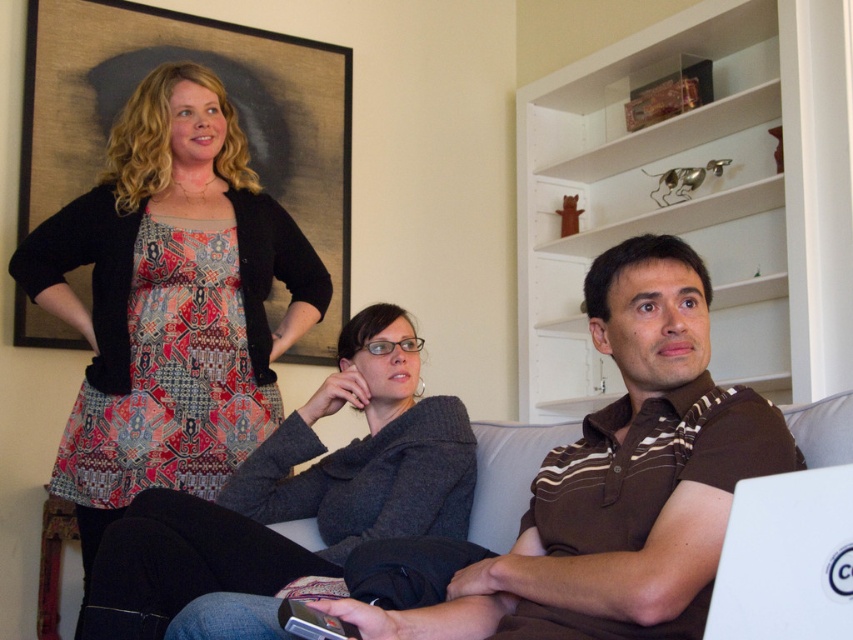
Question: Is wooden framed artwork at upper left to the left of white plastic laptop at lower right from the viewer's perspective?

Choices:
 (A) no
 (B) yes

Answer: (B)

Question: Which point is farther to the camera?

Choices:
 (A) white plastic laptop at lower right
 (B) patterned fabric dress at upper left

Answer: (B)

Question: Which is farther from the knit gray sweater at center?

Choices:
 (A) white plastic laptop at lower right
 (B) brown striped shirt at center
 (C) patterned fabric dress at upper left

Answer: (A)

Question: Can you confirm if brown striped shirt at center is positioned to the left of knit gray sweater at center?

Choices:
 (A) yes
 (B) no

Answer: (B)

Question: Which of these objects is positioned closest to the patterned fabric dress at upper left?

Choices:
 (A) white plastic laptop at lower right
 (B) brown striped shirt at center
 (C) wooden framed artwork at upper left
 (D) knit gray sweater at center

Answer: (D)

Question: Does brown striped shirt at center appear over knit gray sweater at center?

Choices:
 (A) yes
 (B) no

Answer: (A)